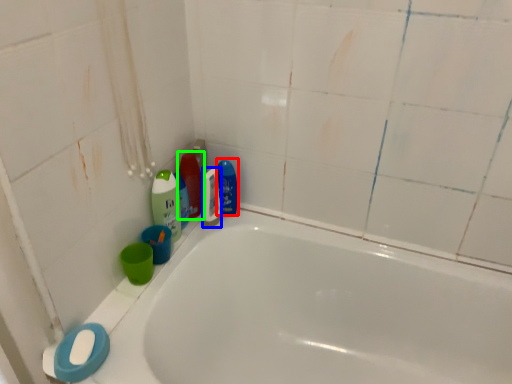
Question: Which object is the farthest from cleaning product (highlighted by a red box)? Choose among these: mouthwash (highlighted by a blue box) or cleaning product (highlighted by a green box).

Choices:
 (A) mouthwash
 (B) cleaning product

Answer: (B)